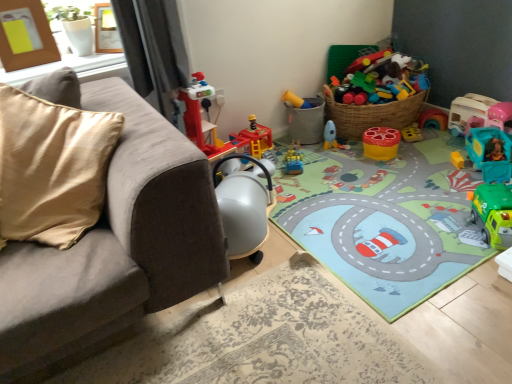
Find the location of a particular element. free area in between green plastic toy car at lower right, placed as the 3th toy when sorted from right to left, and matte plastic bucket at center, the 5th toy when ordered from right to left is located at coordinates (393, 181).